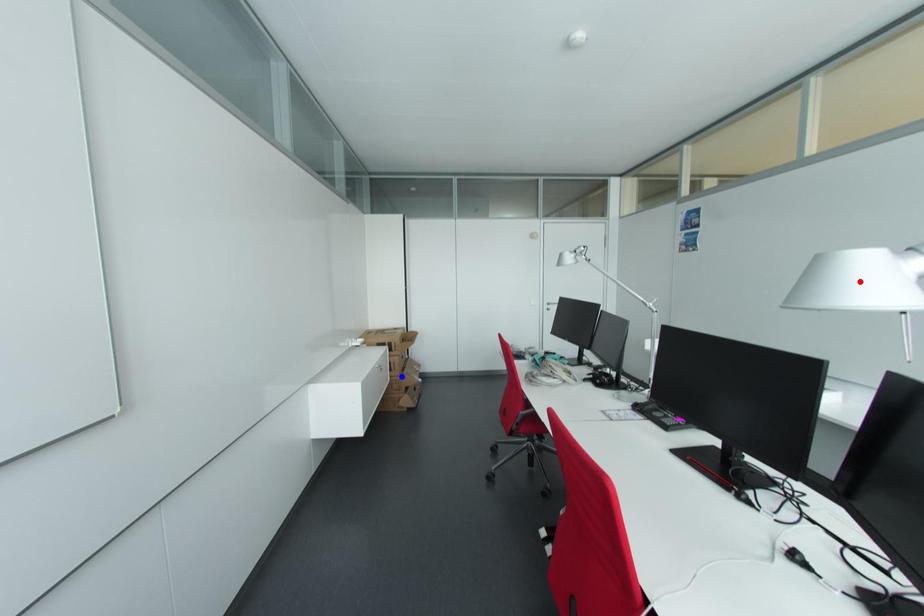
Question: In the image, two points are highlighted. Which point is nearer to the camera? Reply with the corresponding letter.

Choices:
 (A) blue point
 (B) red point

Answer: (B)